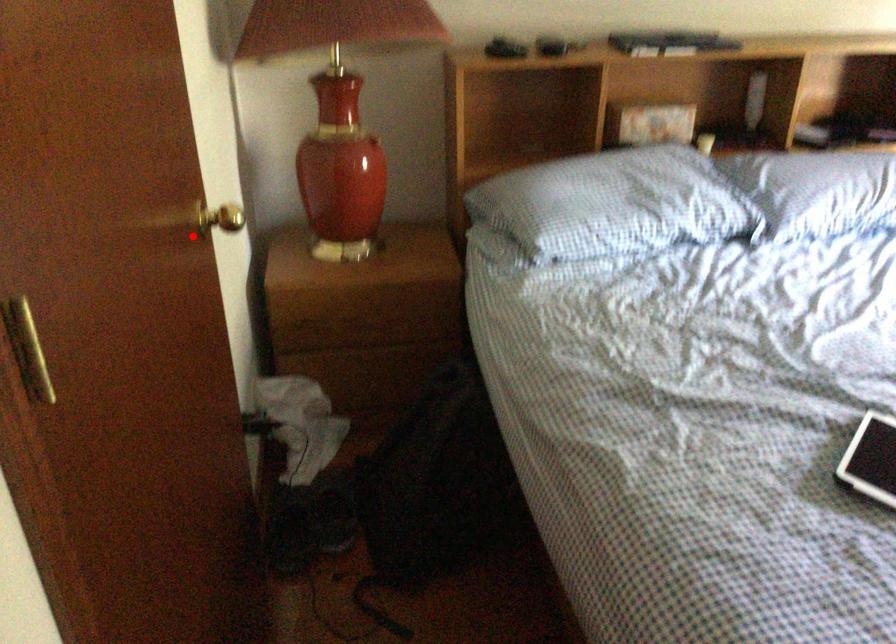
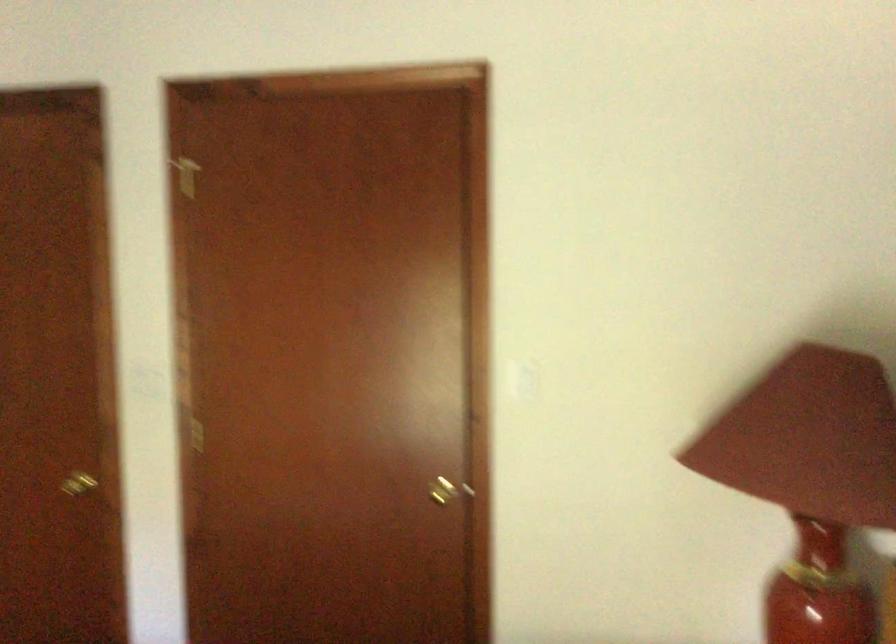
In the second image, find the point that corresponds to the highlighted location in the first image.

(446, 489)